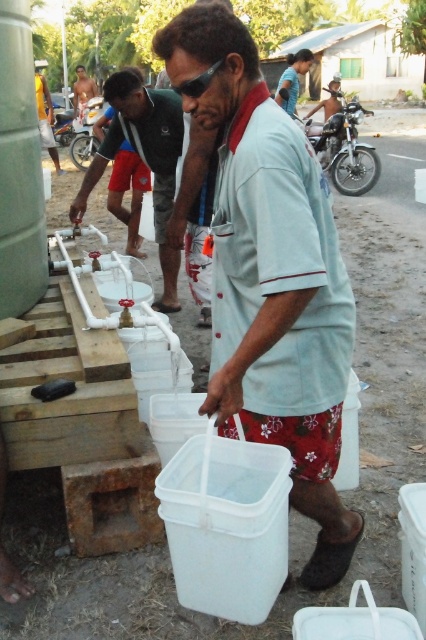
Question: Among these objects, which one is farthest from the camera?

Choices:
 (A) shiny chrome motorcycle at center right
 (B) brushed metal motorcycle at center
 (C) white plastic bucket at center
 (D) light brown wooden pole at upper left

Answer: (D)

Question: Is brushed metal motorcycle at center closer to the viewer compared to light brown wooden pole at upper left?

Choices:
 (A) no
 (B) yes

Answer: (B)

Question: Which is nearer to the yellow shirt at center?

Choices:
 (A) shiny chrome motorcycle at center right
 (B) white plastic bucket at center

Answer: (A)

Question: Considering the relative positions of white plastic bucket at center and shiny chrome motorcycle at center right in the image provided, where is white plastic bucket at center located with respect to shiny chrome motorcycle at center right?

Choices:
 (A) below
 (B) above

Answer: (A)

Question: Is white plastic bucket at center wider than light brown wooden pole at upper left?

Choices:
 (A) yes
 (B) no

Answer: (A)

Question: Which is farther from the brushed metal motorcycle at center?

Choices:
 (A) shiny chrome motorcycle at center right
 (B) yellow shirt at center
 (C) light brown wooden pole at upper left
 (D) white plastic bucket at center

Answer: (D)